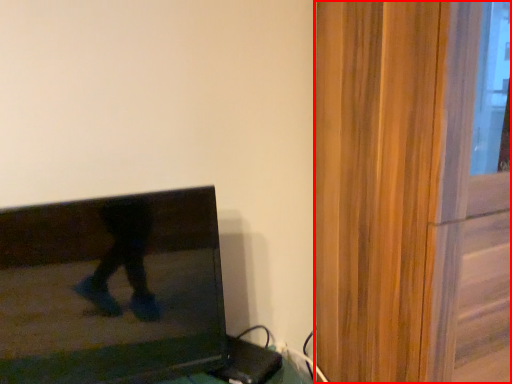
Question: From the image's perspective, where is screen door (annotated by the red box) located relative to television?

Choices:
 (A) below
 (B) above

Answer: (B)